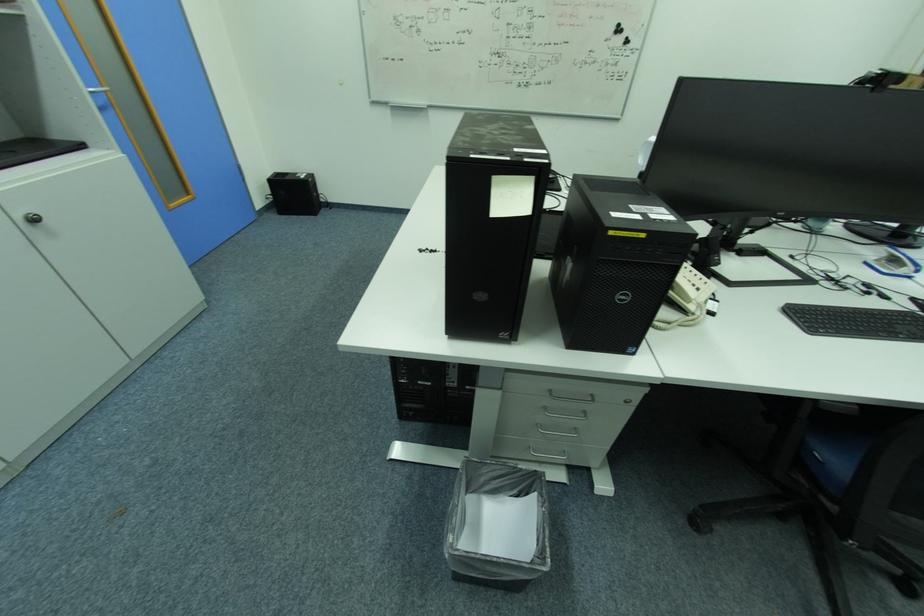
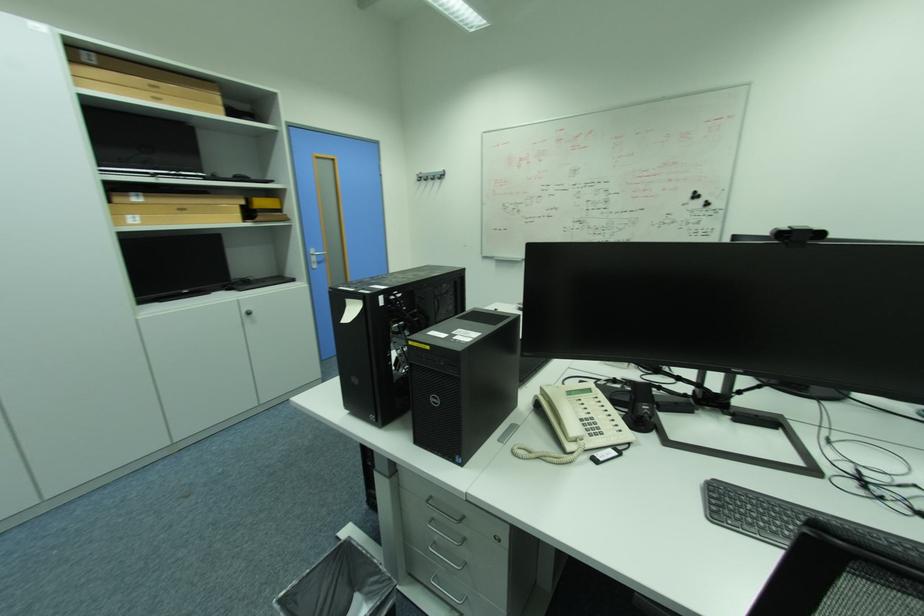
Locate, in the second image, the point that corresponds to (43,222) in the first image.

(257, 314)